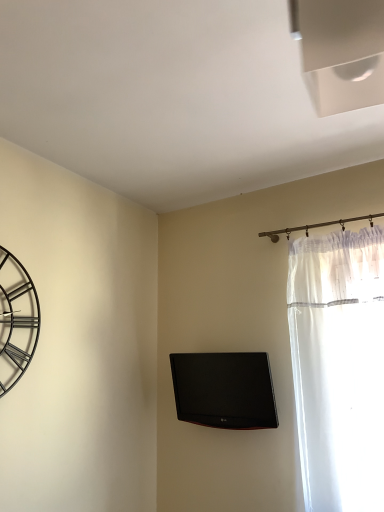
Question: From their relative heights in the image, would you say black glossy tv at center is taller or shorter than metallic black clock at left?

Choices:
 (A) short
 (B) tall

Answer: (A)

Question: From the image's perspective, relative to metallic black clock at left, is black glossy tv at center above or below?

Choices:
 (A) below
 (B) above

Answer: (A)

Question: Is black glossy tv at center bigger or smaller than metallic black clock at left?

Choices:
 (A) small
 (B) big

Answer: (B)

Question: Is point (23, 285) closer or farther from the camera than point (236, 379)?

Choices:
 (A) farther
 (B) closer

Answer: (B)

Question: From a real-world perspective, relative to black glossy tv at center, is metallic black clock at left vertically above or below?

Choices:
 (A) above
 (B) below

Answer: (A)

Question: In terms of width, does metallic black clock at left look wider or thinner when compared to black glossy tv at center?

Choices:
 (A) wide
 (B) thin

Answer: (B)

Question: Is metallic black clock at left in front of or behind black glossy tv at center in the image?

Choices:
 (A) front
 (B) behind

Answer: (A)